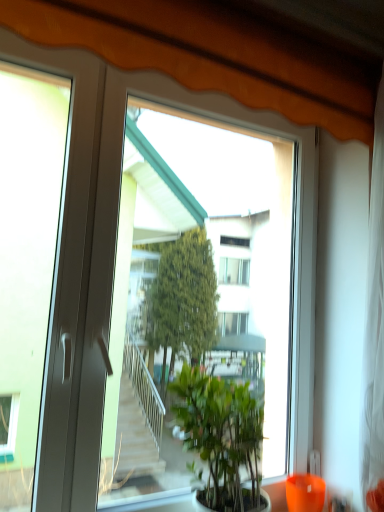
Question: Based on their positions, is transparent glass window at center located to the left or right of green leafy plant at center?

Choices:
 (A) left
 (B) right

Answer: (A)

Question: Which is correct: transparent glass window at center is inside green leafy plant at center, or outside of it?

Choices:
 (A) inside
 (B) outside

Answer: (B)

Question: Estimate the real-world distances between objects in this image. Which object is farther from the transparent glass window at center?

Choices:
 (A) green leafy plant at center
 (B) orange glass vase at lower right

Answer: (B)

Question: Which object is positioned farthest from the orange glass vase at lower right?

Choices:
 (A) transparent glass window at center
 (B) green leafy plant at center

Answer: (A)